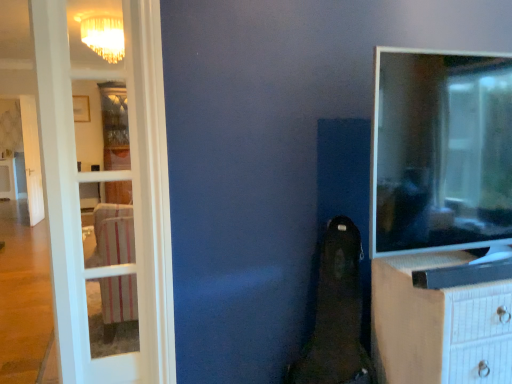
Question: Does white glass door at left have a greater height compared to matte black tv at right?

Choices:
 (A) no
 (B) yes

Answer: (B)

Question: From the image's perspective, is white glass door at left below matte black tv at right?

Choices:
 (A) yes
 (B) no

Answer: (A)

Question: Are white glass door at left and matte black tv at right making contact?

Choices:
 (A) no
 (B) yes

Answer: (A)

Question: Is white glass door at left shorter than matte black tv at right?

Choices:
 (A) yes
 (B) no

Answer: (B)

Question: Does white glass door at left contain matte black tv at right?

Choices:
 (A) yes
 (B) no

Answer: (B)

Question: Are white glass door at left and matte black tv at right far apart?

Choices:
 (A) no
 (B) yes

Answer: (A)

Question: Is matte black tv at right oriented towards white glass door at left?

Choices:
 (A) no
 (B) yes

Answer: (A)

Question: Considering the relative sizes of matte black tv at right and white glass door at left in the image provided, is matte black tv at right shorter than white glass door at left?

Choices:
 (A) yes
 (B) no

Answer: (A)

Question: Does matte black tv at right have a greater height compared to white glass door at left?

Choices:
 (A) no
 (B) yes

Answer: (A)

Question: Is the position of matte black tv at right more distant than that of white glass door at left?

Choices:
 (A) yes
 (B) no

Answer: (B)

Question: From the image's perspective, would you say matte black tv at right is positioned over white glass door at left?

Choices:
 (A) no
 (B) yes

Answer: (B)

Question: Can we say matte black tv at right lies outside white glass door at left?

Choices:
 (A) yes
 (B) no

Answer: (A)

Question: Is white textured chest of drawers at right smaller than white glass door at left?

Choices:
 (A) yes
 (B) no

Answer: (B)